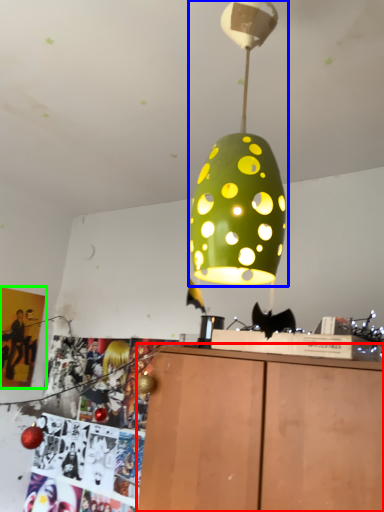
Question: Which object is the closest to the furniture (highlighted by a red box)? Choose among these: lamp (highlighted by a blue box) or poster page (highlighted by a green box).

Choices:
 (A) lamp
 (B) poster page

Answer: (A)